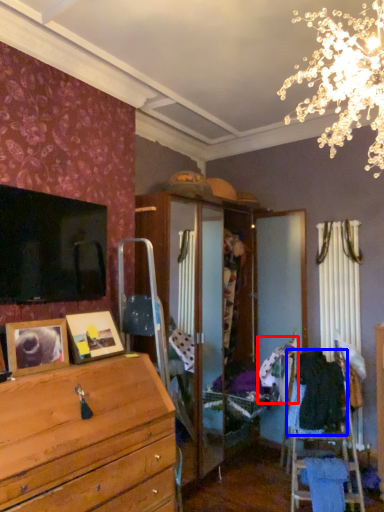
Question: Which object is closer to the camera taking this photo, clothing (highlighted by a red box) or clothing (highlighted by a blue box)?

Choices:
 (A) clothing
 (B) clothing

Answer: (B)